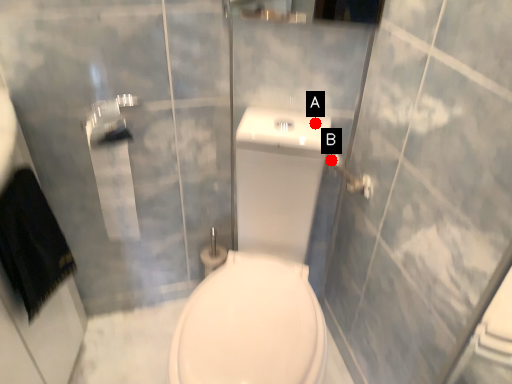
Question: Two points are circled on the image, labeled by A and B beside each circle. Among these points, which one is farthest from the camera?

Choices:
 (A) A is further
 (B) B is further

Answer: (B)